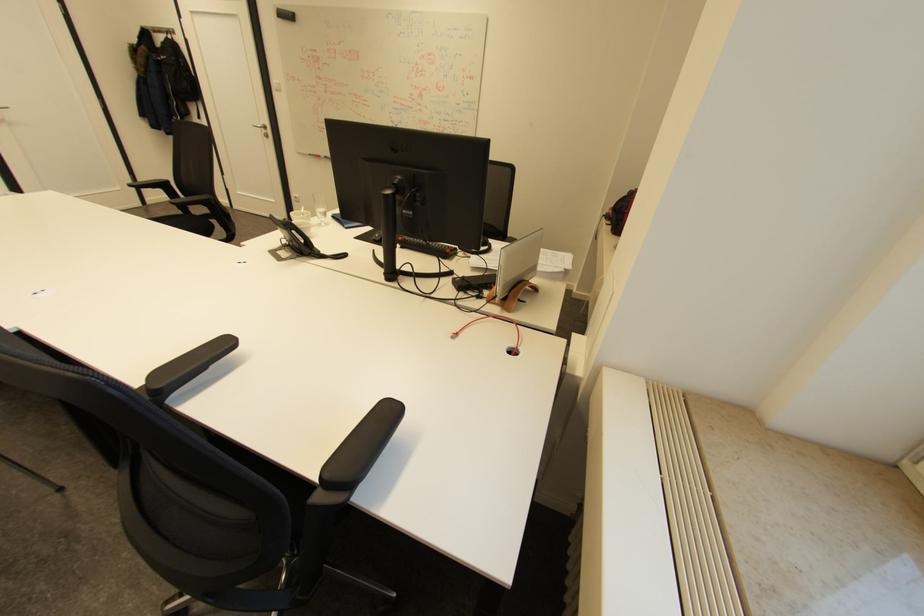
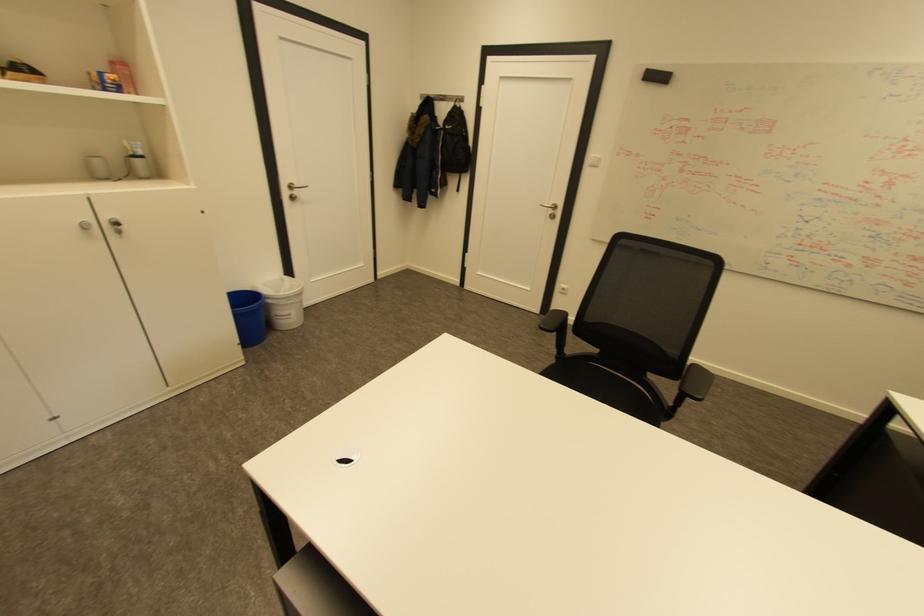
Question: Which direction would the cameraman need to move to produce the second image? Reply with the corresponding letter.

Choices:
 (A) Left
 (B) Right
 (C) Forward
 (D) Backward

Answer: (A)